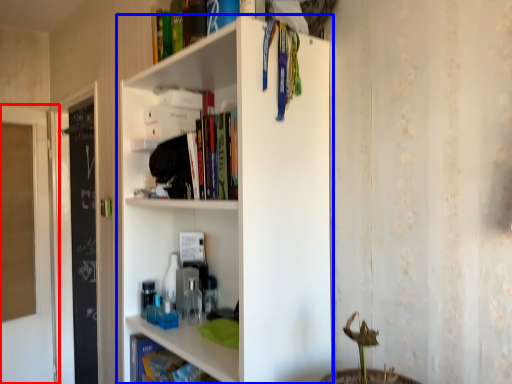
Question: Among these objects, which one is nearest to the camera, glass door (highlighted by a red box) or shelf (highlighted by a blue box)?

Choices:
 (A) glass door
 (B) shelf

Answer: (B)